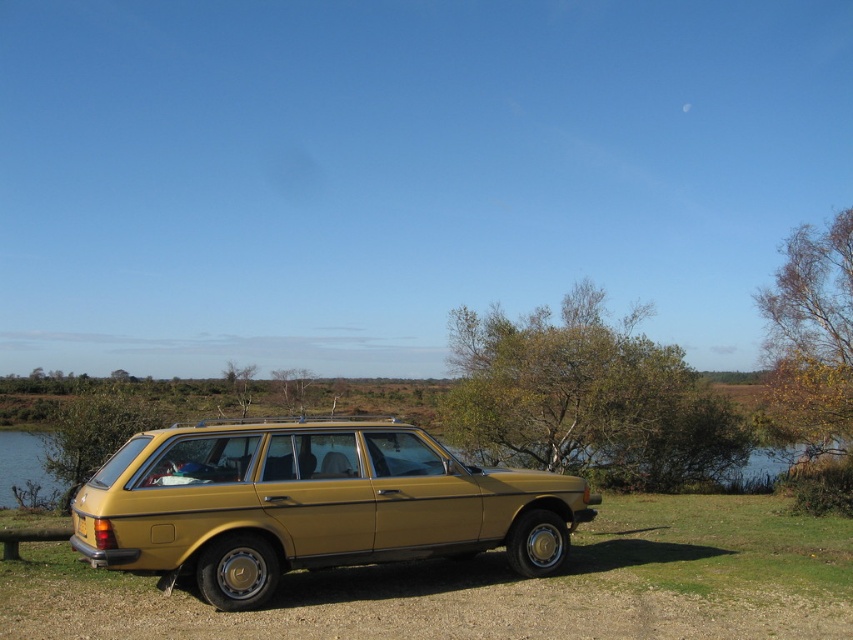
Is gold metallic station wagon at center positioned behind yellow-green leaves at upper right?

No, it is in front of yellow-green leaves at upper right.

Find the location of a particular element. This screenshot has width=853, height=640. gold metallic station wagon at center is located at coordinates (311, 504).

Can you confirm if green leafy tree at center is positioned above yellow-green leaves at upper right?

Actually, green leafy tree at center is below yellow-green leaves at upper right.

Find the location of a particular element. green leafy tree at center is located at coordinates (585, 397).

Does green grass at center have a smaller size compared to yellow-green leaves at upper right?

Yes.

Between point (421, 604) and point (840, 362), which one is positioned behind?

Positioned behind is point (840, 362).

Locate an element on the screen. The height and width of the screenshot is (640, 853). green grass at center is located at coordinates (500, 586).